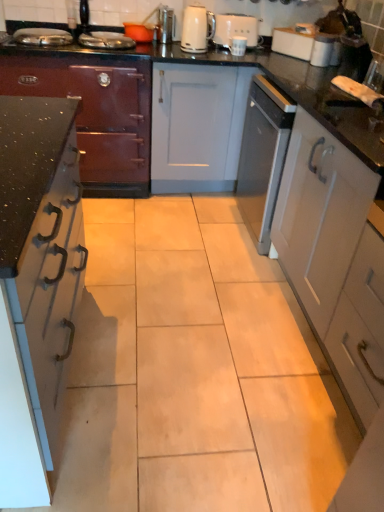
Question: Can you confirm if white glossy cabinet at right, which is the first cabinetry in right-to-left order, is shorter than satin nickel toaster at upper center, marked as the 1th appliance in a right-to-left arrangement?

Choices:
 (A) no
 (B) yes

Answer: (A)

Question: Is the position of white glossy cabinet at right, the third cabinetry from the left, more distant than that of satin nickel toaster at upper center, marked as the 1th appliance in a right-to-left arrangement?

Choices:
 (A) yes
 (B) no

Answer: (B)

Question: Is white glossy cabinet at right, which is the first cabinetry in right-to-left order, positioned beyond the bounds of satin nickel toaster at upper center, marked as the 1th appliance in a right-to-left arrangement?

Choices:
 (A) yes
 (B) no

Answer: (A)

Question: Is white glossy cabinet at right, the third cabinetry from the left, in front of satin nickel toaster at upper center, the second appliance viewed from the left?

Choices:
 (A) no
 (B) yes

Answer: (B)

Question: Considering the relative positions of white glossy cabinet at right, the third cabinetry from the left, and satin nickel toaster at upper center, marked as the 1th appliance in a right-to-left arrangement, in the image provided, is white glossy cabinet at right, the third cabinetry from the left, to the right of satin nickel toaster at upper center, marked as the 1th appliance in a right-to-left arrangement, from the viewer's perspective?

Choices:
 (A) no
 (B) yes

Answer: (B)

Question: From the image's perspective, is black glossy countertop at center located above or below metallic dark gray stove at left, placed as the 1th cabinetry when sorted from left to right?

Choices:
 (A) above
 (B) below

Answer: (B)

Question: Would you say black glossy countertop at center is inside or outside metallic dark gray stove at left, placed as the 1th cabinetry when sorted from left to right?

Choices:
 (A) outside
 (B) inside

Answer: (A)

Question: From a real-world perspective, is black glossy countertop at center positioned above or below metallic dark gray stove at left, placed as the 1th cabinetry when sorted from left to right?

Choices:
 (A) above
 (B) below

Answer: (B)

Question: Considering the positions of black glossy countertop at center and metallic dark gray stove at left, which is the third cabinetry in right-to-left order, in the image, is black glossy countertop at center wider or thinner than metallic dark gray stove at left, which is the third cabinetry in right-to-left order,?

Choices:
 (A) wide
 (B) thin

Answer: (B)

Question: Is black glossy countertop at center to the left or to the right of satin nickel toaster at upper center, the second appliance viewed from the left, in the image?

Choices:
 (A) right
 (B) left

Answer: (A)

Question: Is black glossy countertop at center taller or shorter than satin nickel toaster at upper center, the second appliance viewed from the left?

Choices:
 (A) tall
 (B) short

Answer: (A)

Question: From the image's perspective, relative to satin nickel toaster at upper center, marked as the 1th appliance in a right-to-left arrangement, is black glossy countertop at center above or below?

Choices:
 (A) above
 (B) below

Answer: (B)

Question: Is black glossy countertop at center situated inside satin nickel toaster at upper center, marked as the 1th appliance in a right-to-left arrangement, or outside?

Choices:
 (A) outside
 (B) inside

Answer: (A)

Question: Is white matte coffee machine at upper center situated inside satin nickel toaster at upper center, the second appliance viewed from the left, or outside?

Choices:
 (A) outside
 (B) inside

Answer: (A)

Question: Considering their positions, is white matte coffee machine at upper center located in front of or behind satin nickel toaster at upper center, marked as the 1th appliance in a right-to-left arrangement?

Choices:
 (A) front
 (B) behind

Answer: (B)